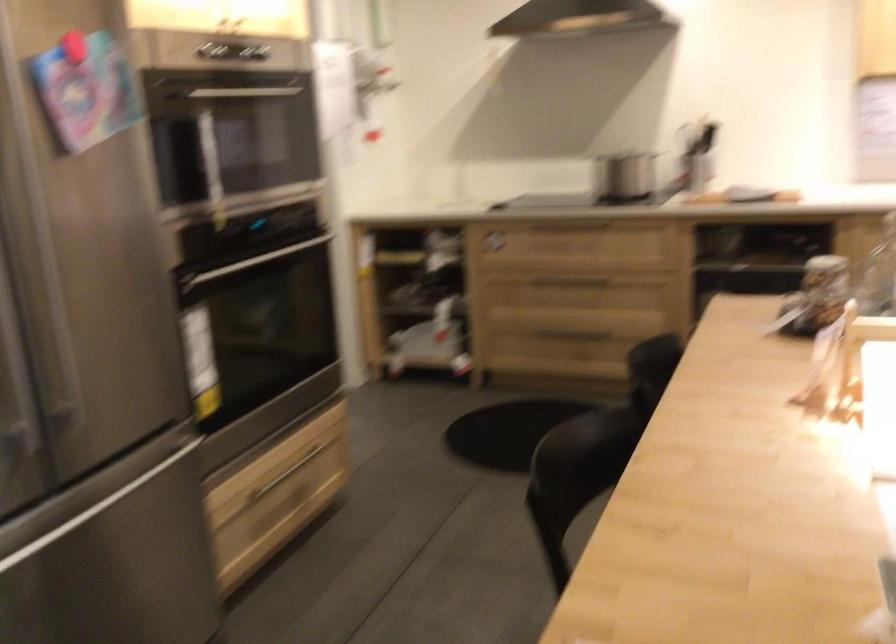
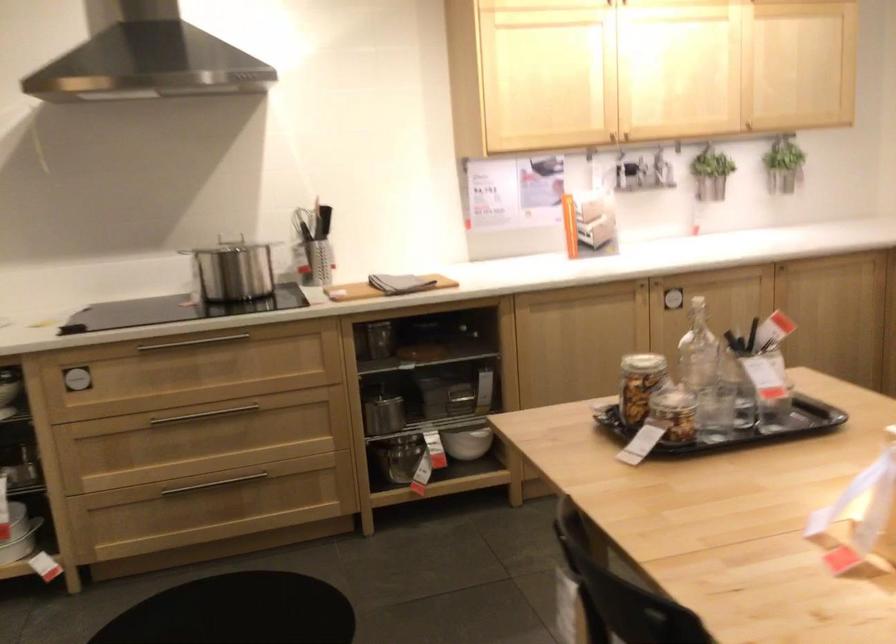
The point at [599,144] is marked in the first image. Where is the corresponding point in the second image?

(186, 245)